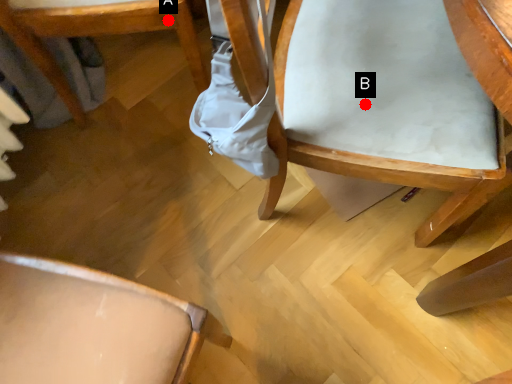
Question: Two points are circled on the image, labeled by A and B beside each circle. Which point is closer to the camera?

Choices:
 (A) A is closer
 (B) B is closer

Answer: (B)